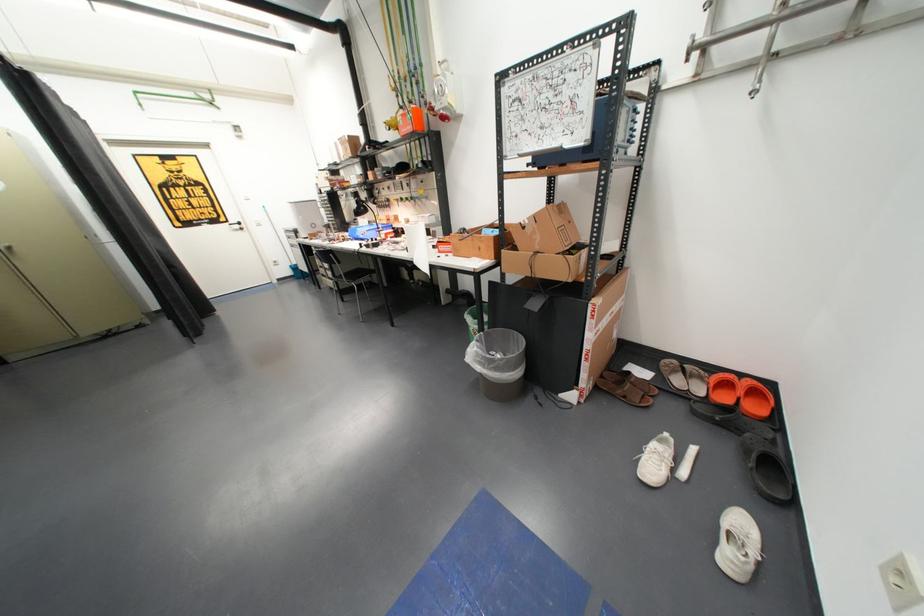
The width and height of the screenshot is (924, 616). In order to click on brown sandal in this screenshot , I will do `click(627, 387)`.